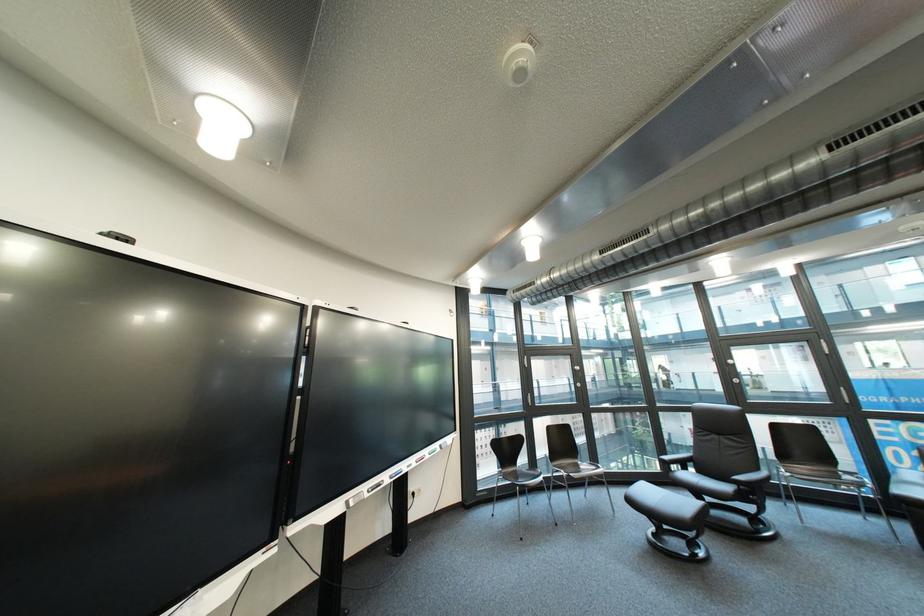
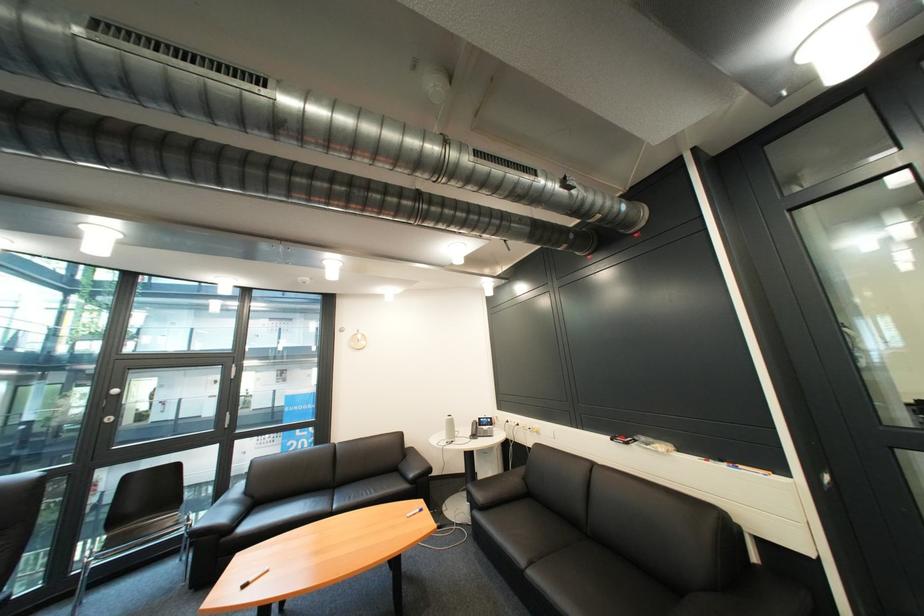
Where in the second image is the point corresponding to pixel 740 371 from the first image?

(118, 408)